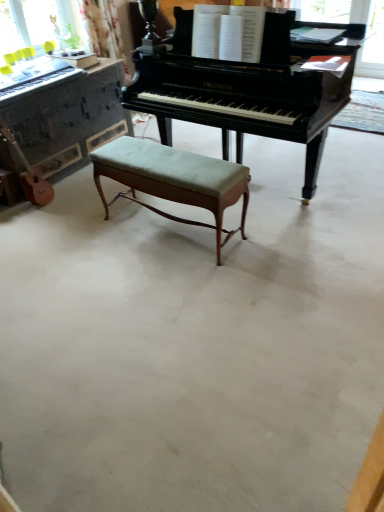
Question: Can you confirm if polished dark wood piano at center, which is the first piano from left to right, is smaller than green fabric stool at center?

Choices:
 (A) yes
 (B) no

Answer: (B)

Question: Is polished dark wood piano at center, the second piano when ordered from right to left, to the left of green fabric stool at center from the viewer's perspective?

Choices:
 (A) yes
 (B) no

Answer: (A)

Question: Does polished dark wood piano at center, which is the first piano from left to right, have a larger size compared to green fabric stool at center?

Choices:
 (A) no
 (B) yes

Answer: (B)

Question: From the image's perspective, is polished dark wood piano at center, the second piano when ordered from right to left, on green fabric stool at center?

Choices:
 (A) no
 (B) yes

Answer: (B)

Question: Is polished dark wood piano at center, which is the first piano from left to right, facing away from green fabric stool at center?

Choices:
 (A) no
 (B) yes

Answer: (A)

Question: Looking at the image, does light brown wood guitar at left seem bigger or smaller compared to matte black keyboard at left?

Choices:
 (A) big
 (B) small

Answer: (A)

Question: In terms of height, does light brown wood guitar at left look taller or shorter compared to matte black keyboard at left?

Choices:
 (A) short
 (B) tall

Answer: (B)

Question: From a real-world perspective, relative to matte black keyboard at left, is light brown wood guitar at left vertically above or below?

Choices:
 (A) above
 (B) below

Answer: (B)

Question: Is point click(x=26, y=184) positioned closer to the camera than point click(x=64, y=77)?

Choices:
 (A) closer
 (B) farther

Answer: (A)

Question: Considering the positions of matte black keyboard at left and light brown wood guitar at left in the image, is matte black keyboard at left wider or thinner than light brown wood guitar at left?

Choices:
 (A) thin
 (B) wide

Answer: (B)

Question: Would you say matte black keyboard at left is to the left or to the right of light brown wood guitar at left in the picture?

Choices:
 (A) right
 (B) left

Answer: (A)

Question: From a real-world perspective, is matte black keyboard at left physically located above or below light brown wood guitar at left?

Choices:
 (A) above
 (B) below

Answer: (A)

Question: Is matte black keyboard at left taller or shorter than light brown wood guitar at left?

Choices:
 (A) short
 (B) tall

Answer: (A)

Question: Visually, is green fabric stool at center positioned to the left or to the right of light brown wood guitar at left?

Choices:
 (A) right
 (B) left

Answer: (A)

Question: Relative to light brown wood guitar at left, is green fabric stool at center in front or behind?

Choices:
 (A) front
 (B) behind

Answer: (A)